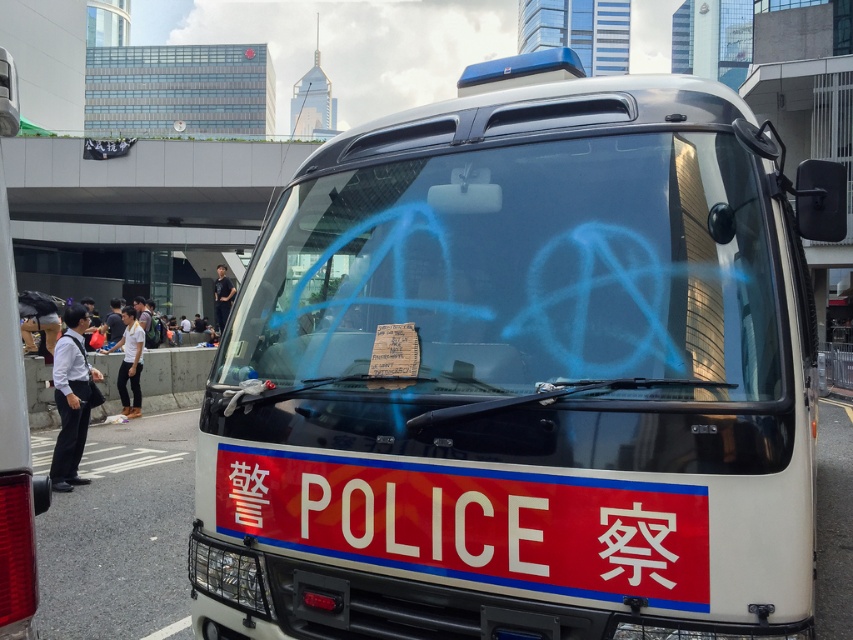
You are a delivery person trying to load a package onto the white glossy police van at center. The package is 1.5 meters tall. Can the package be placed on top of the transparent glass windshield at center without exceeding its height?

The white glossy police van at center has a greater height compared to the transparent glass windshield at center. Therefore, the package that is 1.5 meters tall may not fit on top of the windshield as the van itself is taller, but the windshield height is not specified. However, since the van is taller than the windshield, the windshield might be shorter than the van, so the package might exceed the windshield height if the windshield is lower. Without exact measurements, it is uncertain.

Looking at this image, you are a pedestrian standing in front of the white glossy police van at center and the transparent glass windshield at center. Which object is positioned to the left?

The transparent glass windshield at center is positioned to the left of the white glossy police van at center.